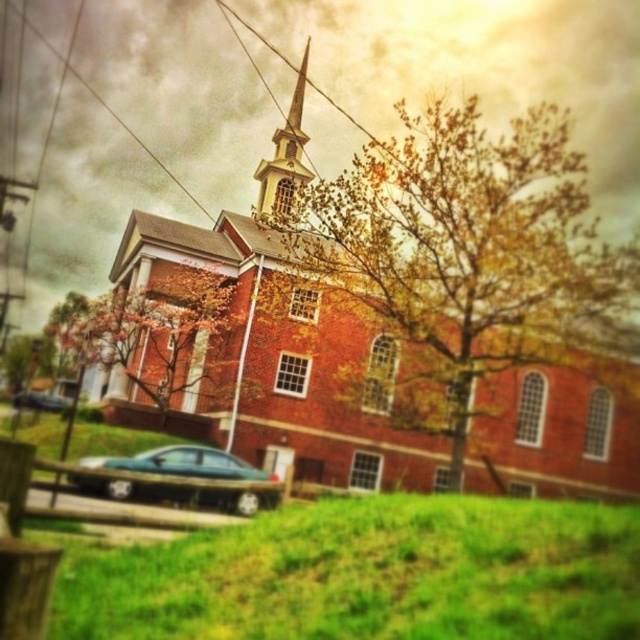
Question: Which object appears farthest from the camera in this image?

Choices:
 (A) green grassy field at lower center
 (B) metallic blue sedan at lower left

Answer: (B)

Question: Which object is positioned farthest from the brown textured tree at lower left?

Choices:
 (A) metallic teal sedan at lower center
 (B) green grassy field at lower center
 (C) yellow leafy tree at center

Answer: (B)

Question: Based on their relative distances, which object is nearer to the green grassy field at lower center?

Choices:
 (A) metallic blue sedan at lower left
 (B) metallic teal sedan at lower center

Answer: (B)

Question: Is autumn leaves at center wider than metallic teal sedan at lower center?

Choices:
 (A) no
 (B) yes

Answer: (B)

Question: Does metallic teal sedan at lower center have a lesser width compared to brown textured tree at lower left?

Choices:
 (A) yes
 (B) no

Answer: (A)

Question: Does green grassy field at lower center appear on the right side of metallic blue sedan at lower left?

Choices:
 (A) no
 (B) yes

Answer: (B)